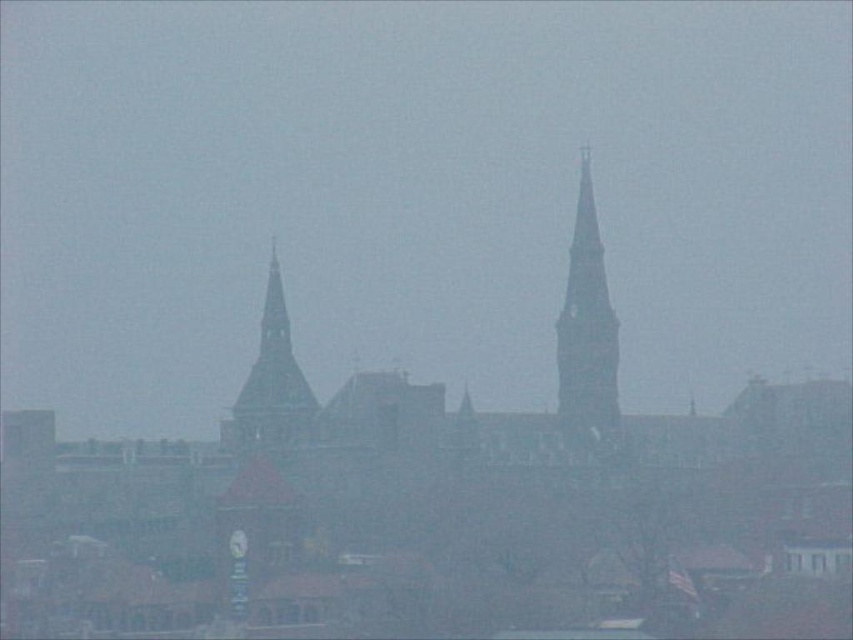
You are a city planner assessing the spacing between the smooth gray stone bell tower at center right and the smooth stone bell tower at center. The city requires a minimum of 50 meters between such structures for safety. Does the current distance meet this requirement?

The distance between the smooth gray stone bell tower at center right and the smooth stone bell tower at center is 55.80 meters, which exceeds the required 50 meters, so it meets the safety requirement.

You are a tourist standing in the city square and want to take a photo of both the smooth gray stone bell tower at center right and the smooth stone bell tower at center. Which bell tower should you move towards to get a clearer picture of it?

You should move towards the smooth gray stone bell tower at center right because it is closer to you than the smooth stone bell tower at center, so it will appear clearer in your photo.

You are a tourist in the city and want to take a photo of both the smooth gray stone bell tower at center right and the smooth stone bell tower at center. However, you notice that one of them is partially hidden. Which bell tower is blocking the view of the other?

The smooth gray stone bell tower at center right is above the smooth stone bell tower at center, so the smooth gray stone bell tower at center right is blocking the view of the smooth stone bell tower at center.